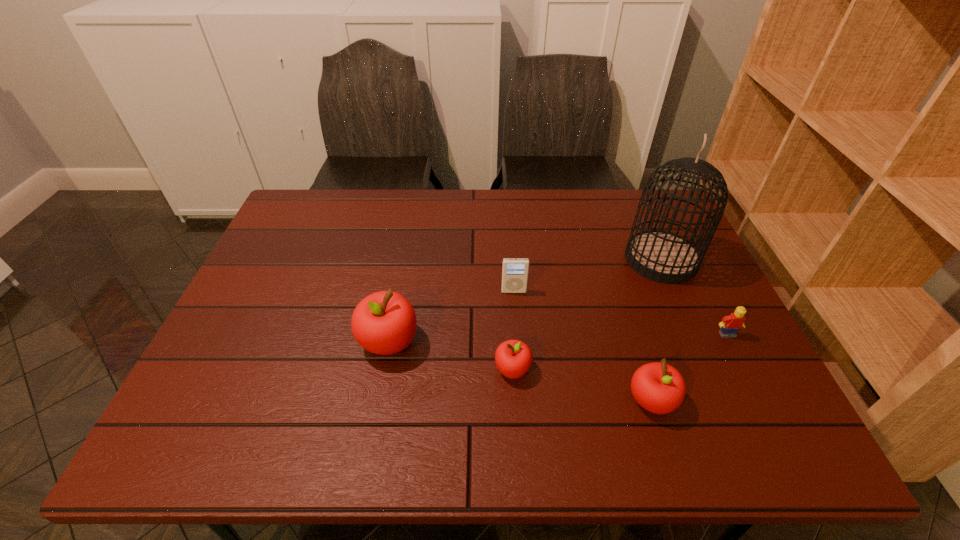
Find the location of a particular element. This screenshot has height=540, width=960. empty space that is in between the Lego and the shortest apple is located at coordinates (620, 352).

Identify which object is the fourth closest to the tallest apple. Please provide its 2D coordinates. Your answer should be formatted as a tuple, i.e. [(x, y)], where the tuple contains the x and y coordinates of a point satisfying the conditions above.

[(661, 256)]

Locate which object is the third closest to the tallest object. Please provide its 2D coordinates. Your answer should be formatted as a tuple, i.e. [(x, y)], where the tuple contains the x and y coordinates of a point satisfying the conditions above.

[(658, 387)]

At what (x,y) coordinates should I click in order to perform the action: click on apple that can be found as the closest to the second farthest object. Please return your answer as a coordinate pair (x, y). Looking at the image, I should click on (513, 358).

Identify which apple is the second nearest to the rightmost apple. Please provide its 2D coordinates. Your answer should be formatted as a tuple, i.e. [(x, y)], where the tuple contains the x and y coordinates of a point satisfying the conditions above.

[(384, 323)]

Identify the location of vacant space that satisfies the following two spatial constraints: 1. on the front-facing side of the iPod; 2. on the right side of the second tallest apple. The width and height of the screenshot is (960, 540). (522, 401).

Identify the location of blank area in the image that satisfies the following two spatial constraints: 1. on the back side of the shortest apple; 2. on the right side of the tallest object. The image size is (960, 540). (506, 260).